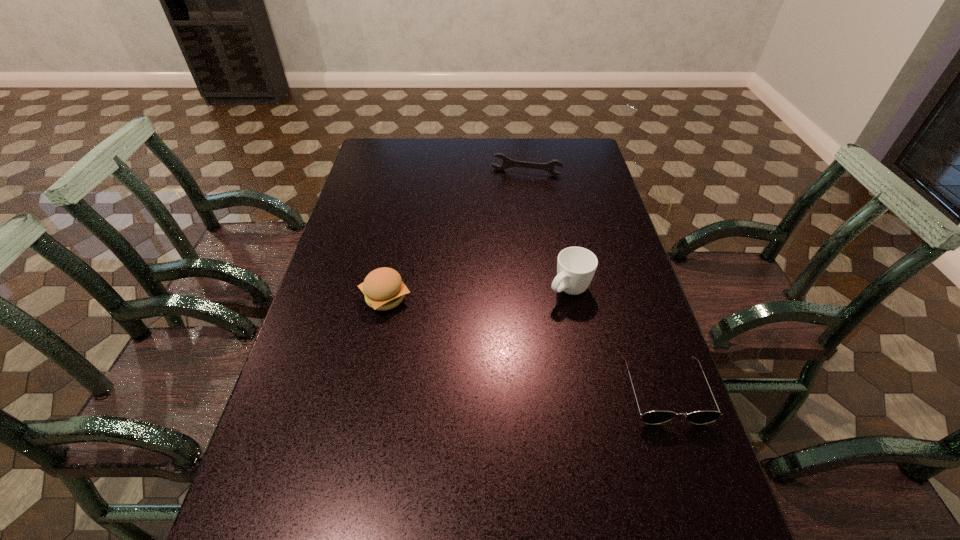
I want to click on vacant area between the wrench and the rightmost object, so click(595, 281).

This screenshot has height=540, width=960. What are the coordinates of `vacant space that is in between the cup and the rightmost object` in the screenshot? It's located at (617, 340).

Where is `free space between the cup and the rightmost object`? This screenshot has width=960, height=540. free space between the cup and the rightmost object is located at coordinates (617, 340).

Where is `free space between the cup and the leftmost object`? free space between the cup and the leftmost object is located at coordinates (477, 294).

Where is `object that is the third closest to the rightmost object`? object that is the third closest to the rightmost object is located at coordinates (507, 162).

The height and width of the screenshot is (540, 960). In order to click on object that ranks as the second closest to the cup in this screenshot , I will do `click(383, 288)`.

Find the location of a particular element. Image resolution: width=960 pixels, height=540 pixels. free space in the image that satisfies the following two spatial constraints: 1. on the front side of the cup; 2. on the left side of the farthest object is located at coordinates (542, 290).